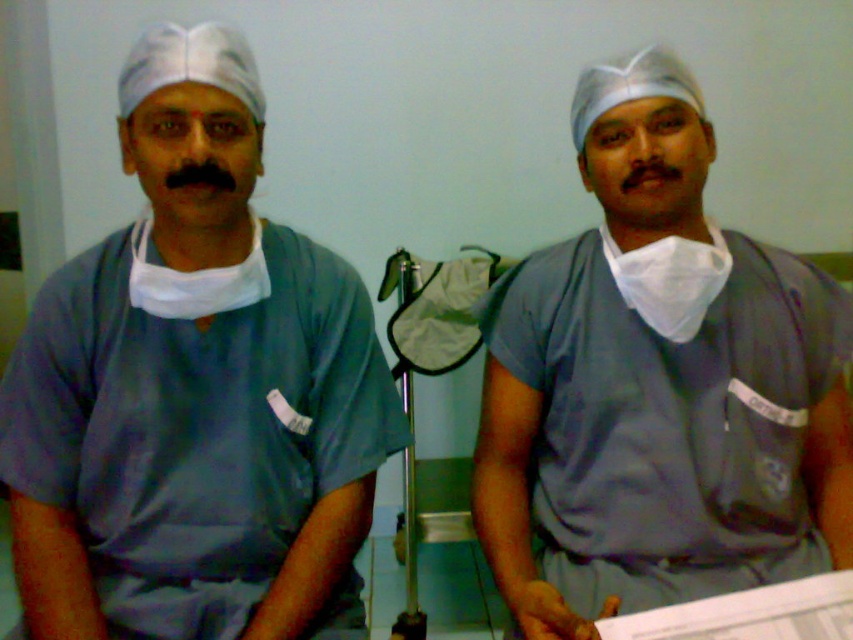
Question: Is matte blue scrubs at center below gray matte scrubs at center?

Choices:
 (A) yes
 (B) no

Answer: (B)

Question: Is matte blue scrubs at center wider than gray matte scrubs at center?

Choices:
 (A) no
 (B) yes

Answer: (A)

Question: Is matte blue scrubs at center to the right of gray matte scrubs at center from the viewer's perspective?

Choices:
 (A) no
 (B) yes

Answer: (A)

Question: Which object appears closest to the camera in this image?

Choices:
 (A) gray matte scrubs at center
 (B) matte blue scrubs at center

Answer: (A)